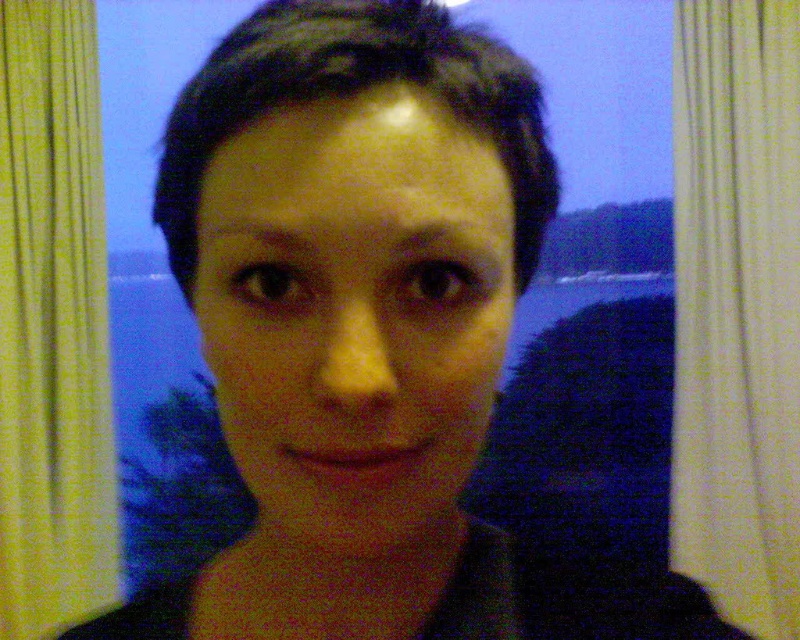
From the picture: Who is shorter, yellow fabric curtain at left or yellow textured curtain at left?

Standing shorter between the two is yellow fabric curtain at left.

Based on the photo, who is positioned more to the right, yellow fabric curtain at left or yellow textured curtain at left?

Positioned to the right is yellow fabric curtain at left.

This screenshot has height=640, width=800. What are the coordinates of `yellow fabric curtain at left` in the screenshot? It's located at (737, 307).